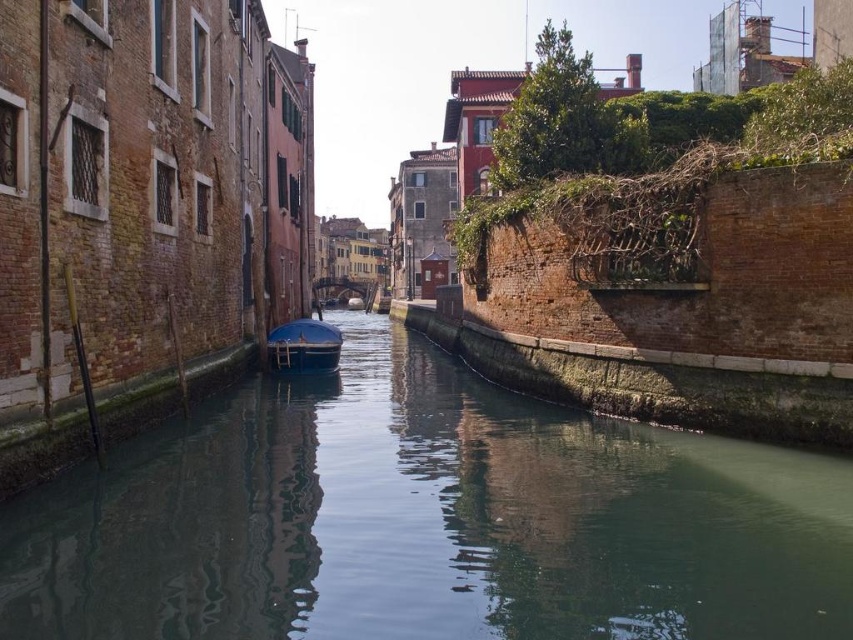
Can you confirm if green smooth water at center is smaller than matte blue boat at center?

No.

In the scene shown: Between green smooth water at center and matte blue boat at center, which one has more height?

With more height is green smooth water at center.

Is point (260, 627) farther from camera compared to point (332, 349)?

No, it is not.

You are a GUI agent. You are given a task and a screenshot of the screen. Output one action in this format:
    pyautogui.click(x=<x>, y=<y>)
    Task: Click on the green smooth water at center
    
    Given the screenshot: What is the action you would take?
    click(427, 520)